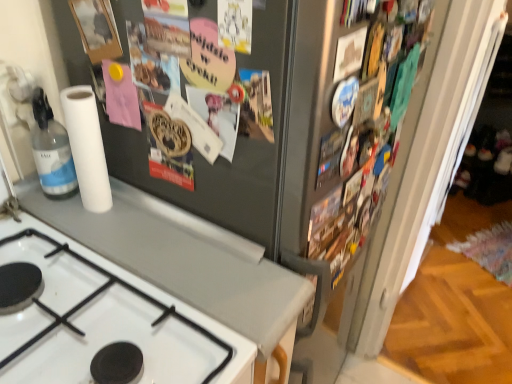
This screenshot has width=512, height=384. I want to click on free space in front of white matte paper towel at left, so click(x=101, y=238).